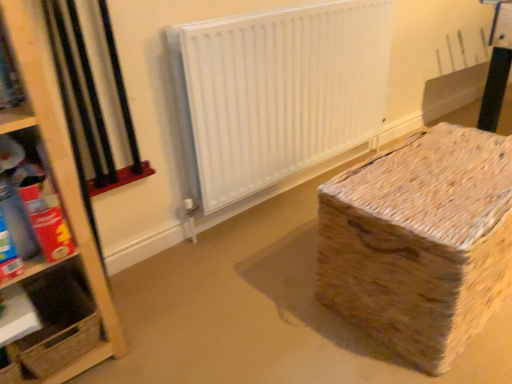
Image resolution: width=512 pixels, height=384 pixels. Describe the element at coordinates (34, 198) in the screenshot. I see `cardboard box at left, which is counted as the 1th shelf, starting from the top` at that location.

At what (x,y) coordinates should I click in order to perform the action: click on wooden at left, which ranks as the first shelf in bottom-to-top order. Please return your answer as a coordinate pair (x, y). Looking at the image, I should click on (55, 324).

At what (x,y) coordinates should I click in order to perform the action: click on woven cardboard box at lower right. Please return your answer as a coordinate pair (x, y). Image resolution: width=512 pixels, height=384 pixels. Looking at the image, I should click on (420, 242).

From a real-world perspective, does cardboard box at left, which is counted as the 1th shelf, starting from the top, sit lower than white matte radiator at center?

No, from a real-world perspective, cardboard box at left, which is counted as the 1th shelf, starting from the top, is not below white matte radiator at center.

Are cardboard box at left, which is counted as the 1th shelf, starting from the top, and white matte radiator at center far apart?

Actually, cardboard box at left, which is counted as the 1th shelf, starting from the top, and white matte radiator at center are a little close together.

From the image's perspective, between white matte radiator at center and wooden at left, which ranks as the first shelf in bottom-to-top order, who is located below?

wooden at left, which ranks as the first shelf in bottom-to-top order, appears lower in the image.

Which of these two, white matte radiator at center or wooden at left, the second shelf from the top, stands shorter?

With less height is wooden at left, the second shelf from the top.

Is white matte radiator at center beside wooden at left, the second shelf from the top?

They are not placed beside each other.

Consider the image. Is woven cardboard box at lower right next to wooden at left, which ranks as the first shelf in bottom-to-top order?

No, woven cardboard box at lower right is not in contact with wooden at left, which ranks as the first shelf in bottom-to-top order.

Who is smaller, woven cardboard box at lower right or wooden at left, the second shelf from the top?

wooden at left, the second shelf from the top, is smaller.

Considering the relative sizes of woven cardboard box at lower right and wooden at left, which ranks as the first shelf in bottom-to-top order, in the image provided, is woven cardboard box at lower right thinner than wooden at left, which ranks as the first shelf in bottom-to-top order,?

Incorrect, the width of woven cardboard box at lower right is not less than that of wooden at left, which ranks as the first shelf in bottom-to-top order.

Between woven cardboard box at lower right and wooden at left, the second shelf from the top, which one is positioned behind?

Positioned behind is wooden at left, the second shelf from the top.

Considering the sizes of objects woven cardboard box at lower right and white matte radiator at center in the image provided, who is bigger, woven cardboard box at lower right or white matte radiator at center?

woven cardboard box at lower right.

Locate an element on the screen. The width and height of the screenshot is (512, 384). cardboard box on the right of white matte radiator at center is located at coordinates (420, 242).

Between woven cardboard box at lower right and white matte radiator at center, which one has smaller width?

With smaller width is white matte radiator at center.

What's the angular difference between woven cardboard box at lower right and white matte radiator at center's facing directions?

The angle between the facing direction of woven cardboard box at lower right and the facing direction of white matte radiator at center is 2.37 degrees.

From the image's perspective, which is above, white matte radiator at center or cardboard box at left, which is counted as the 1th shelf, starting from the top?

white matte radiator at center appears higher in the image.

Could you measure the distance between white matte radiator at center and cardboard box at left, which is counted as the 1th shelf, starting from the top?

They are 38.61 inches apart.

Between white matte radiator at center and cardboard box at left, which is counted as the 1th shelf, starting from the top, which one has larger width?

With larger width is cardboard box at left, which is counted as the 1th shelf, starting from the top.

Is white matte radiator at center taller than cardboard box at left, which is counted as the 1th shelf, starting from the top?

Indeed, white matte radiator at center has a greater height compared to cardboard box at left, which is counted as the 1th shelf, starting from the top.

Considering the positions of objects cardboard box at left, the 2th shelf from the bottom, and wooden at left, the second shelf from the top, in the image provided, who is behind, cardboard box at left, the 2th shelf from the bottom, or wooden at left, the second shelf from the top,?

wooden at left, the second shelf from the top, is behind.

Is cardboard box at left, which is counted as the 1th shelf, starting from the top, aimed at wooden at left, which ranks as the first shelf in bottom-to-top order?

No, cardboard box at left, which is counted as the 1th shelf, starting from the top, is not turned towards wooden at left, which ranks as the first shelf in bottom-to-top order.

Between cardboard box at left, the 2th shelf from the bottom, and wooden at left, the second shelf from the top, which one has larger width?

With larger width is cardboard box at left, the 2th shelf from the bottom.

Does cardboard box at left, the 2th shelf from the bottom, contain wooden at left, the second shelf from the top?

No.

Which is behind, wooden at left, which ranks as the first shelf in bottom-to-top order, or cardboard box at left, which is counted as the 1th shelf, starting from the top?

wooden at left, which ranks as the first shelf in bottom-to-top order, is further from the camera.

Does wooden at left, the second shelf from the top, have a greater width compared to cardboard box at left, which is counted as the 1th shelf, starting from the top?

No, wooden at left, the second shelf from the top, is not wider than cardboard box at left, which is counted as the 1th shelf, starting from the top.

Is wooden at left, the second shelf from the top, oriented towards cardboard box at left, which is counted as the 1th shelf, starting from the top?

No, wooden at left, the second shelf from the top, is not aimed at cardboard box at left, which is counted as the 1th shelf, starting from the top.

From their relative heights in the image, would you say wooden at left, the second shelf from the top, is taller or shorter than cardboard box at left, the 2th shelf from the bottom?

Clearly, wooden at left, the second shelf from the top, is shorter compared to cardboard box at left, the 2th shelf from the bottom.

Identify the location of radiator behind the cardboard box at left, the 2th shelf from the bottom. This screenshot has width=512, height=384. tap(278, 93).

Identify the location of shelf directly beneath the white matte radiator at center (from a real-world perspective). (55, 324).

Looking at the image, which one is located further to wooden at left, the second shelf from the top, woven cardboard box at lower right or cardboard box at left, which is counted as the 1th shelf, starting from the top?

woven cardboard box at lower right is positioned further to the anchor wooden at left, the second shelf from the top.

From the image, which object appears to be farther from white matte radiator at center, cardboard box at left, the 2th shelf from the bottom, or wooden at left, the second shelf from the top?

cardboard box at left, the 2th shelf from the bottom.

Considering their positions, is woven cardboard box at lower right positioned closer to white matte radiator at center than wooden at left, which ranks as the first shelf in bottom-to-top order?

Among the two, woven cardboard box at lower right is located nearer to white matte radiator at center.

Based on their spatial positions, is white matte radiator at center or woven cardboard box at lower right closer to cardboard box at left, which is counted as the 1th shelf, starting from the top?

Among the two, woven cardboard box at lower right is located nearer to cardboard box at left, which is counted as the 1th shelf, starting from the top.

Based on the photo, from the image, which object appears to be farther from wooden at left, the second shelf from the top, woven cardboard box at lower right or white matte radiator at center?

white matte radiator at center lies further to wooden at left, the second shelf from the top, than the other object.

When comparing their distances from woven cardboard box at lower right, does wooden at left, the second shelf from the top, or white matte radiator at center seem closer?

white matte radiator at center is positioned closer to the anchor woven cardboard box at lower right.

Estimate the real-world distances between objects in this image. Which object is further from woven cardboard box at lower right, cardboard box at left, the 2th shelf from the bottom, or white matte radiator at center?

cardboard box at left, the 2th shelf from the bottom, is further to woven cardboard box at lower right.

Looking at the image, which one is located further to woven cardboard box at lower right, white matte radiator at center or cardboard box at left, which is counted as the 1th shelf, starting from the top?

Among the two, cardboard box at left, which is counted as the 1th shelf, starting from the top, is located further to woven cardboard box at lower right.

Locate an element on the screen. The height and width of the screenshot is (384, 512). radiator located between wooden at left, the second shelf from the top, and woven cardboard box at lower right in the left-right direction is located at coordinates (278, 93).

Identify the location of radiator between cardboard box at left, the 2th shelf from the bottom, and woven cardboard box at lower right. (278, 93).

At what (x,y) coordinates should I click in order to perform the action: click on shelf between wooden at left, the second shelf from the top, and white matte radiator at center from left to right. Please return your answer as a coordinate pair (x, y). The width and height of the screenshot is (512, 384). Looking at the image, I should click on click(x=34, y=198).

Identify the location of shelf located between wooden at left, which ranks as the first shelf in bottom-to-top order, and woven cardboard box at lower right in the left-right direction. (34, 198).